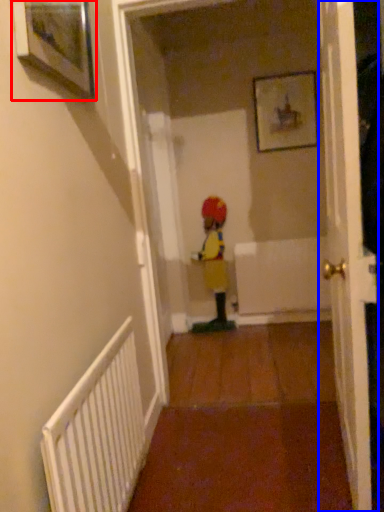
Question: Which object is closer to the camera taking this photo, picture frame (highlighted by a red box) or door (highlighted by a blue box)?

Choices:
 (A) picture frame
 (B) door

Answer: (B)